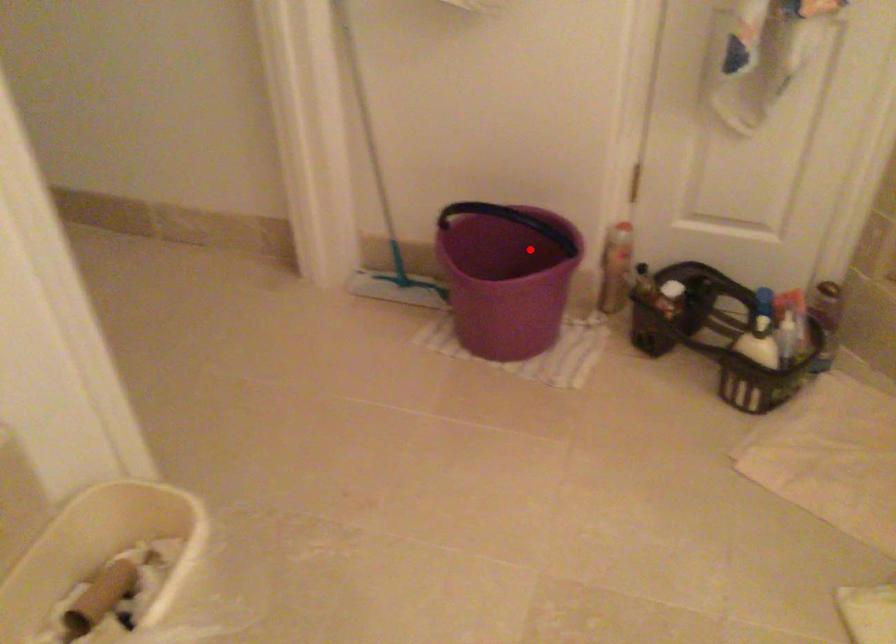
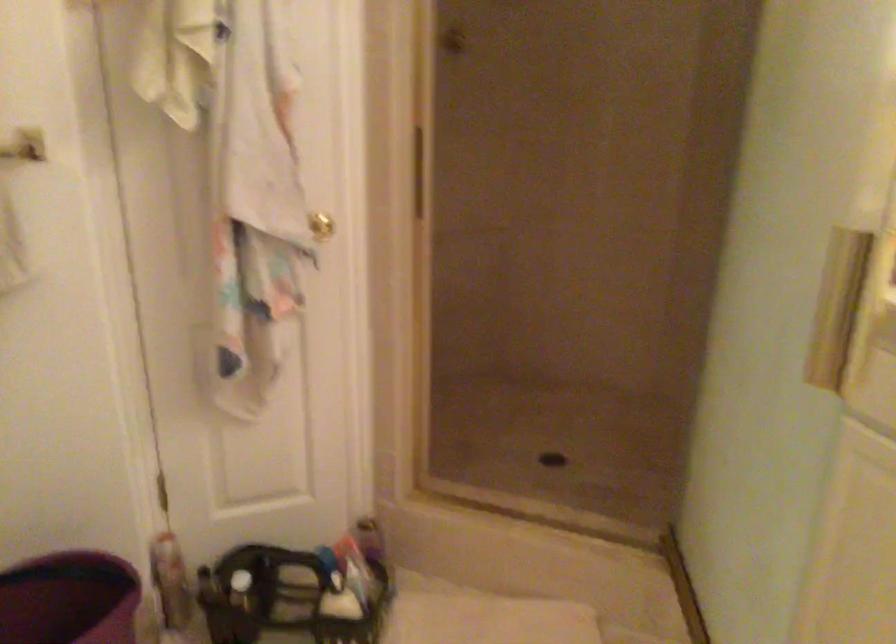
Question: I am providing you with two images of the same scene from different viewpoints. A red point is marked on the first image. At the location where the point appears in image 1, is it still visible in image 2?

Choices:
 (A) Yes
 (B) No

Answer: (A)